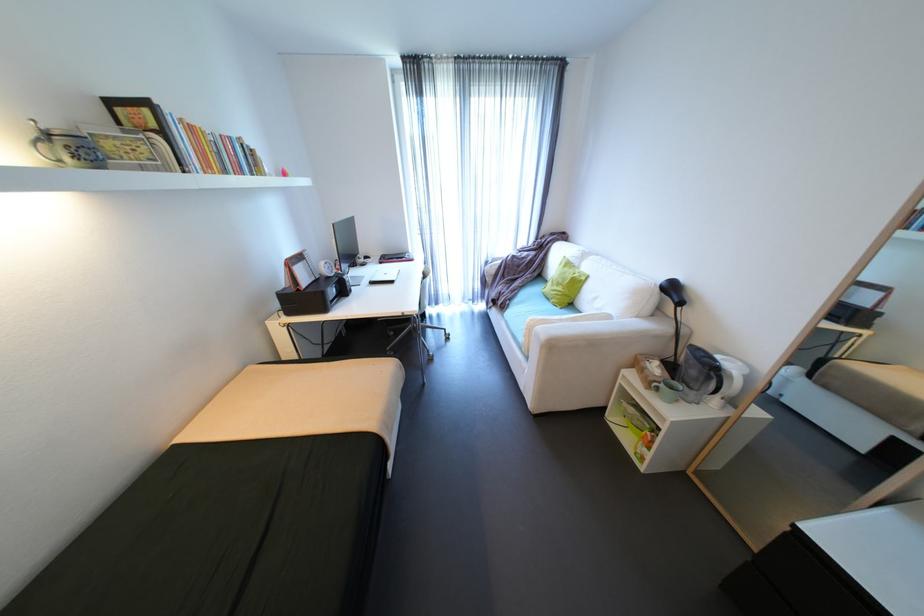
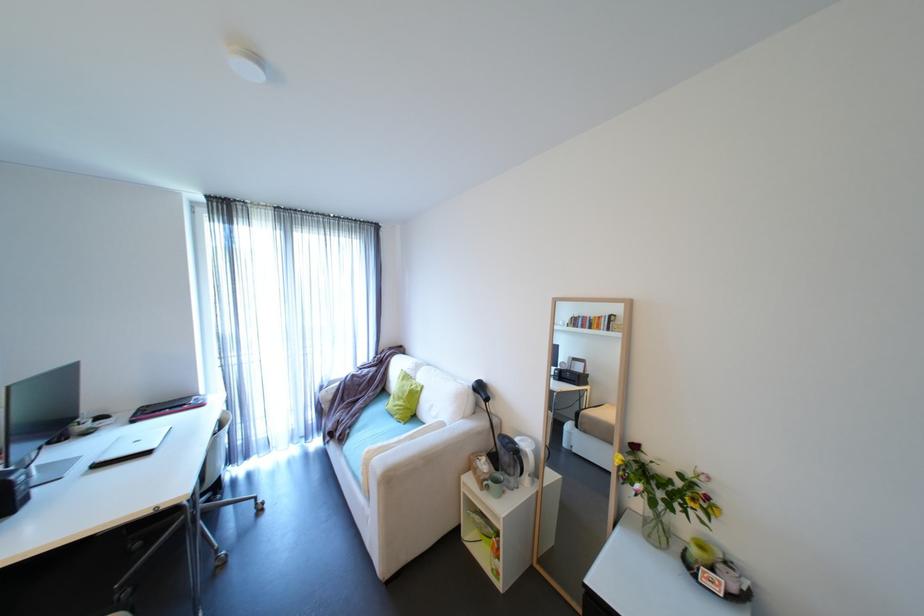
The point at (508, 306) is marked in the first image. Where is the corresponding point in the second image?

(347, 438)